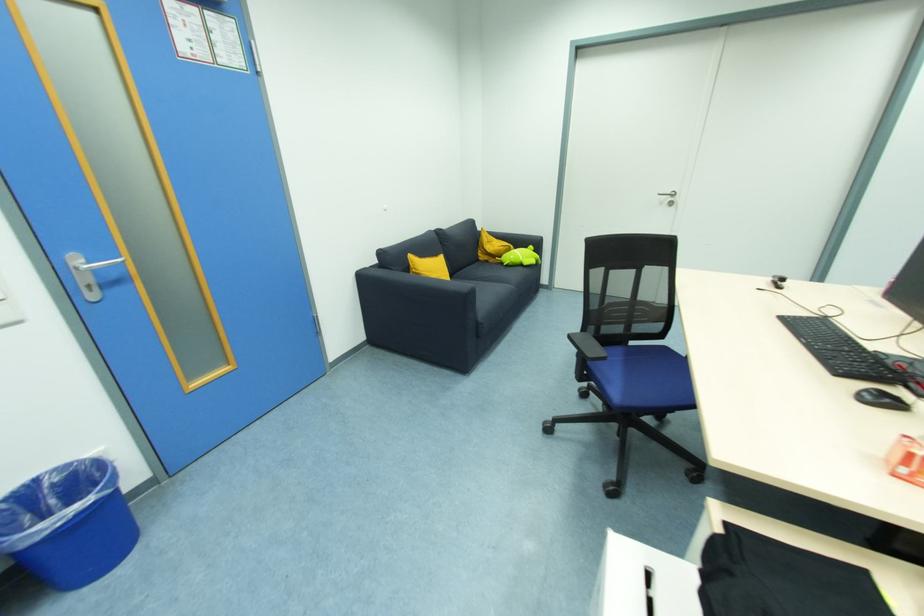
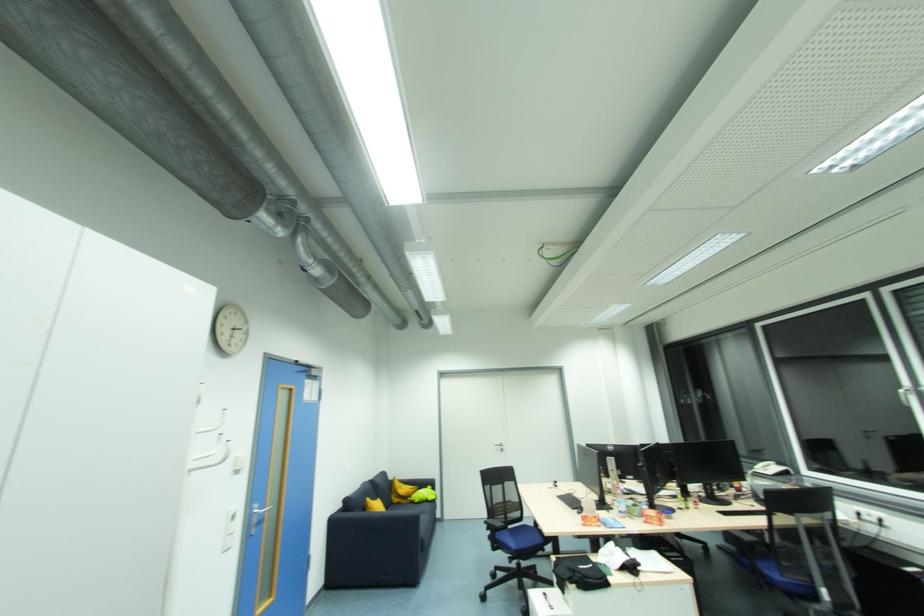
The point at (484, 259) is marked in the first image. Where is the corresponding point in the second image?

(397, 501)